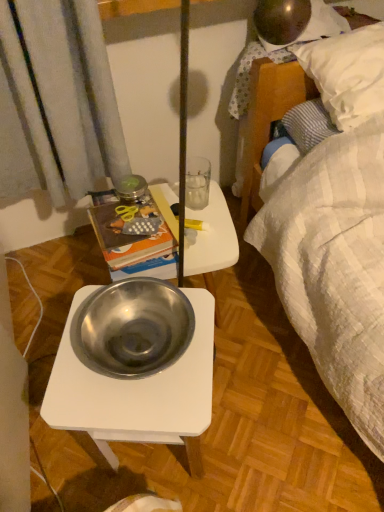
Question: From a real-world perspective, is polished stainless steel bowl at center above or below hardcover book at upper left?

Choices:
 (A) above
 (B) below

Answer: (A)

Question: Based on their sizes in the image, would you say polished stainless steel bowl at center is bigger or smaller than hardcover book at upper left?

Choices:
 (A) small
 (B) big

Answer: (A)

Question: Which object is positioned closest to the polished stainless steel bowl at center?

Choices:
 (A) metallic silver bowl at center
 (B) hardcover book at upper left
 (C) polished stainless steel bowl at center

Answer: (C)

Question: Which of these objects is positioned closest to the polished stainless steel bowl at center?

Choices:
 (A) polished stainless steel bowl at center
 (B) hardcover book at upper left
 (C) metallic silver bowl at center

Answer: (A)